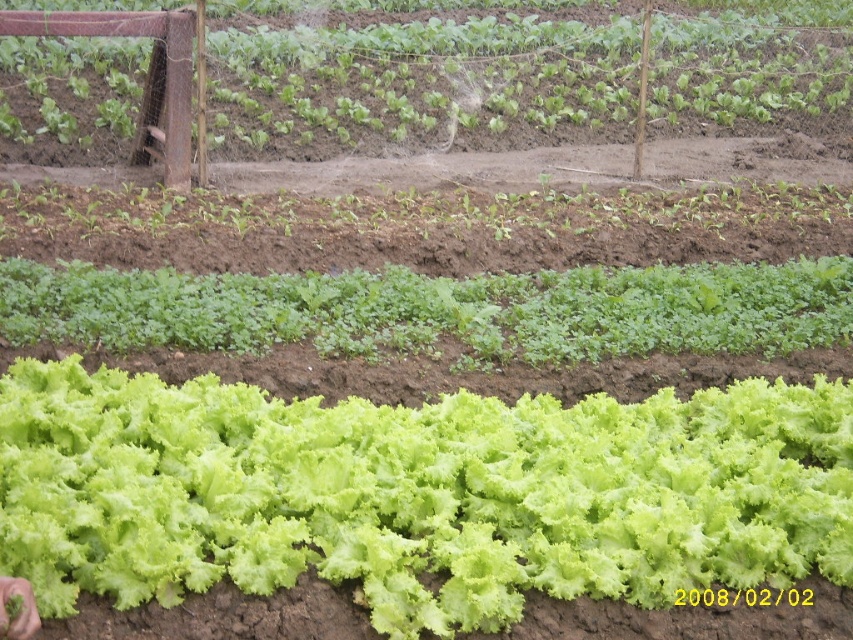
Question: Does green leafy lettuce at upper center appear on the right side of green leafy at center?

Choices:
 (A) yes
 (B) no

Answer: (A)

Question: Which object is positioned farthest from the green leafy at center?

Choices:
 (A) green leafy plant at center
 (B) green leafy lettuce at lower center

Answer: (A)

Question: Is green leafy at center to the right of green leafy plant at center from the viewer's perspective?

Choices:
 (A) no
 (B) yes

Answer: (B)

Question: Which object is the closest to the green leafy lettuce at upper center?

Choices:
 (A) green leafy lettuce at lower center
 (B) green leafy at center
 (C) green leafy plant at center

Answer: (C)

Question: Which point is farther to the camera?

Choices:
 (A) green leafy lettuce at upper center
 (B) green leafy plant at center
 (C) green leafy lettuce at lower center

Answer: (A)

Question: Does green leafy lettuce at lower center appear over green leafy plant at center?

Choices:
 (A) no
 (B) yes

Answer: (A)